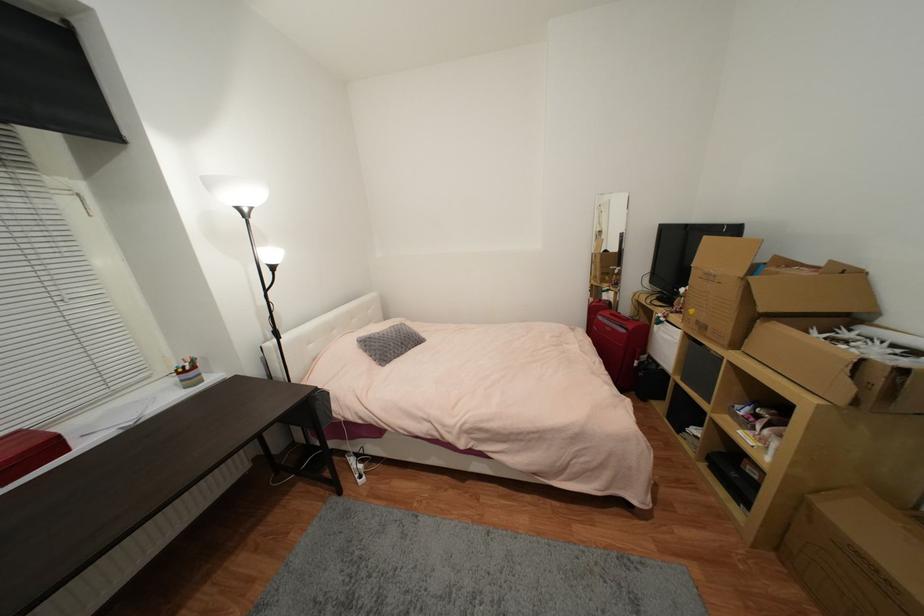
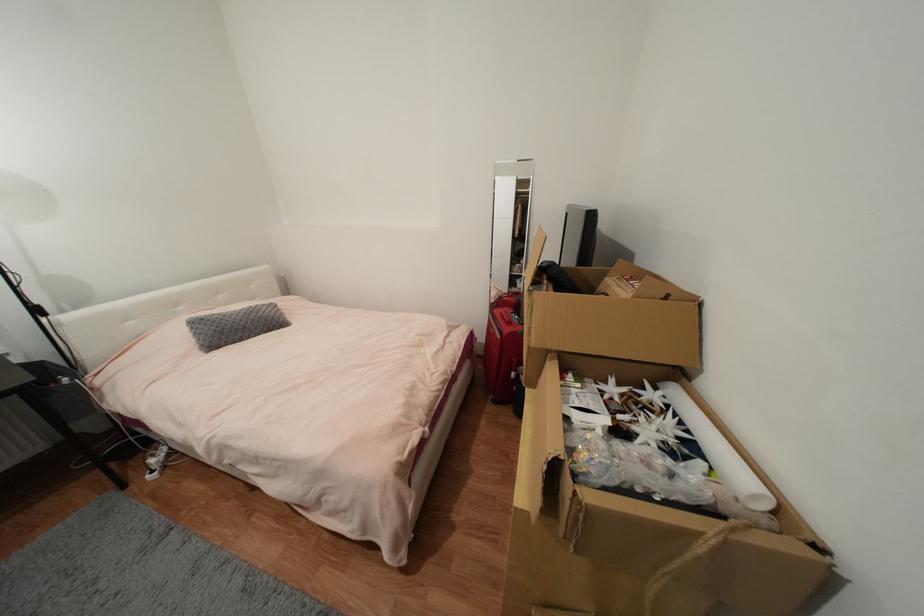
In the second image, find the point that corresponds to point (860, 334) in the first image.

(664, 394)